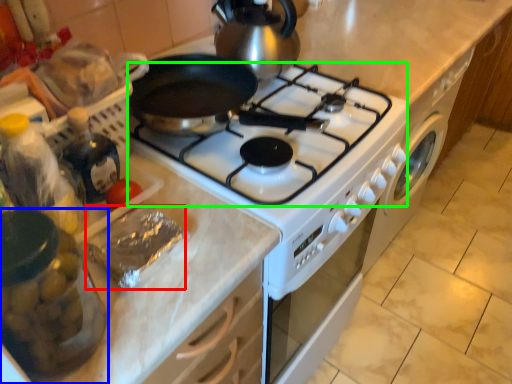
Question: Considering the real-world distances, which object is closest to food (highlighted by a red box)? kitchen appliance (highlighted by a blue box) or gas stove (highlighted by a green box).

Choices:
 (A) kitchen appliance
 (B) gas stove

Answer: (A)